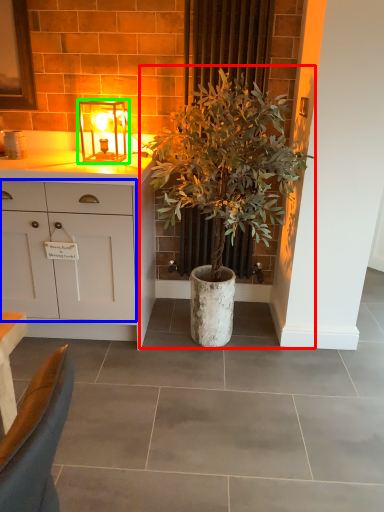
Question: Which object is the closest to the houseplant (highlighted by a red box)? Choose among these: cabinetry (highlighted by a blue box) or lamp (highlighted by a green box).

Choices:
 (A) cabinetry
 (B) lamp

Answer: (A)